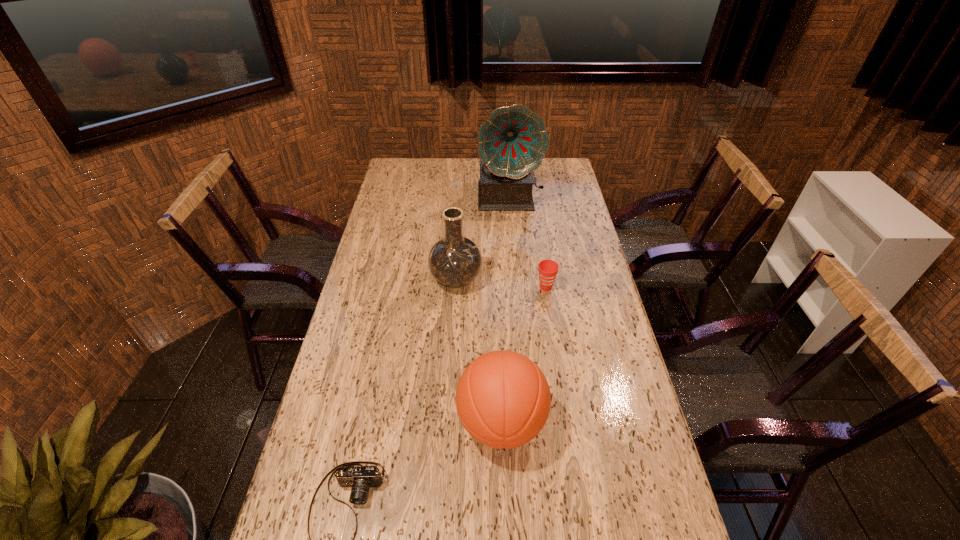
Image resolution: width=960 pixels, height=540 pixels. I want to click on vacant space at the left edge of the desktop, so (338, 465).

Image resolution: width=960 pixels, height=540 pixels. In the image, there is a desktop. Identify the location of vacant space at the right edge. (609, 512).

Where is `vacant position at the far right corner of the desktop`? The height and width of the screenshot is (540, 960). vacant position at the far right corner of the desktop is located at coordinates (550, 180).

You are a GUI agent. You are given a task and a screenshot of the screen. Output one action in this format:
    pyautogui.click(x=<x>, y=<y>)
    Task: Click on the free space between the farthest object and the basketball
    Image resolution: width=960 pixels, height=540 pixels.
    Given the screenshot: What is the action you would take?
    pyautogui.click(x=506, y=310)

Identify the location of vacant area that lies between the tallest object and the vase. The width and height of the screenshot is (960, 540). (483, 239).

Where is `empty location between the tallest object and the fourth tallest object`? The height and width of the screenshot is (540, 960). empty location between the tallest object and the fourth tallest object is located at coordinates (528, 242).

Locate an element on the screen. The width and height of the screenshot is (960, 540). vacant area that lies between the basketball and the tallest object is located at coordinates (506, 310).

At what (x,y) coordinates should I click in order to perform the action: click on free space between the record player and the vase. Please return your answer as a coordinate pair (x, y). Looking at the image, I should click on (483, 239).

You are a GUI agent. You are given a task and a screenshot of the screen. Output one action in this format:
    pyautogui.click(x=<x>, y=<y>)
    Task: Click on the free space between the fourth shortest object and the second shortest object
    
    Given the screenshot: What is the action you would take?
    pyautogui.click(x=501, y=284)

I want to click on free space between the fourth shortest object and the fourth tallest object, so click(x=501, y=284).